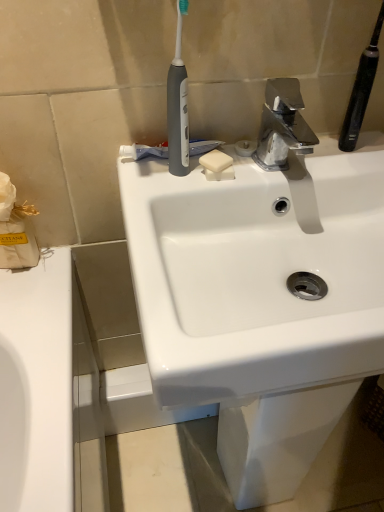
You are a GUI agent. You are given a task and a screenshot of the screen. Output one action in this format:
    pyautogui.click(x=<x>, y=<y>)
    Task: Click on the unoccupied region to the right of white matte toothpaste at center
    Image resolution: width=384 pixels, height=512 pixels.
    Given the screenshot: What is the action you would take?
    pyautogui.click(x=276, y=164)